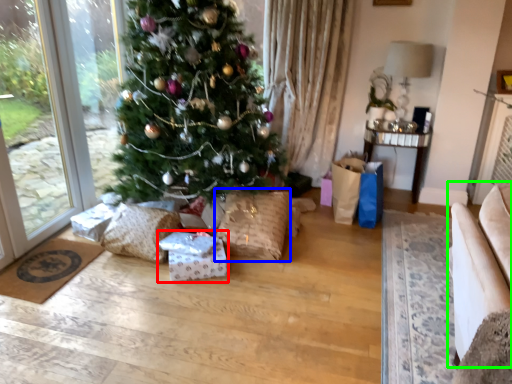
Question: Which object is the closest to the package (highlighted by a red box)? Choose among these: pillow (highlighted by a blue box) or armchair (highlighted by a green box).

Choices:
 (A) pillow
 (B) armchair

Answer: (A)